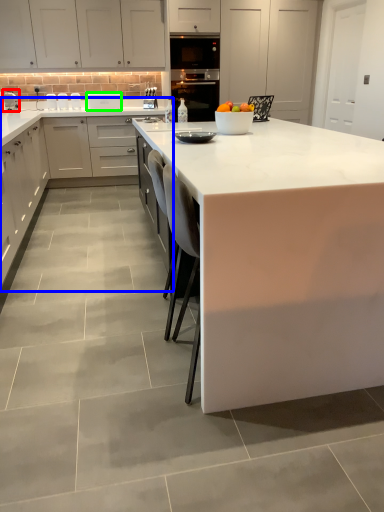
Question: Considering the real-world distances, which object is farthest from appliance (highlighted by a red box)? countertop (highlighted by a blue box) or kitchen appliance (highlighted by a green box)?

Choices:
 (A) countertop
 (B) kitchen appliance

Answer: (A)